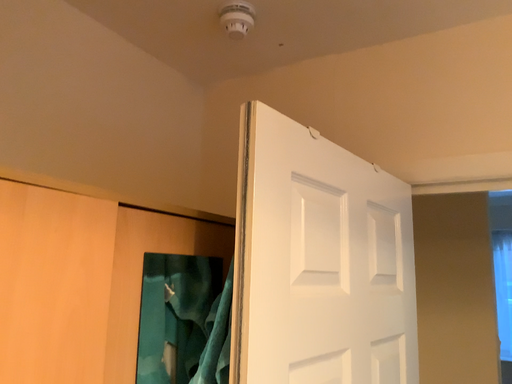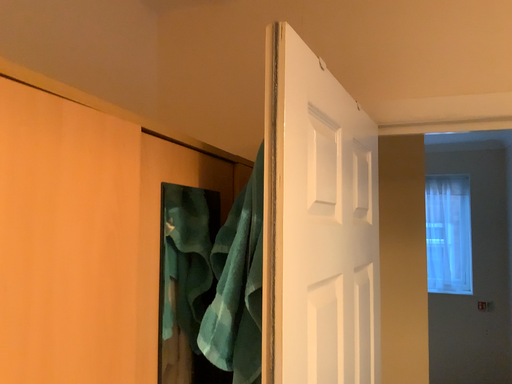
Question: Which way did the camera rotate in the video?

Choices:
 (A) rotated downward
 (B) rotated upward

Answer: (A)